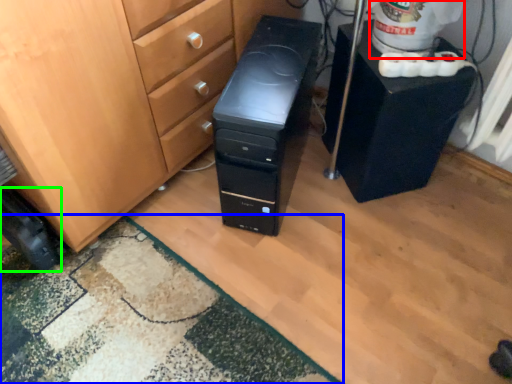
Question: Which object is positioned closest to water cooler (highlighted by a red box)? Select from doormat (highlighted by a blue box) and wheel (highlighted by a green box).

Choices:
 (A) doormat
 (B) wheel

Answer: (A)